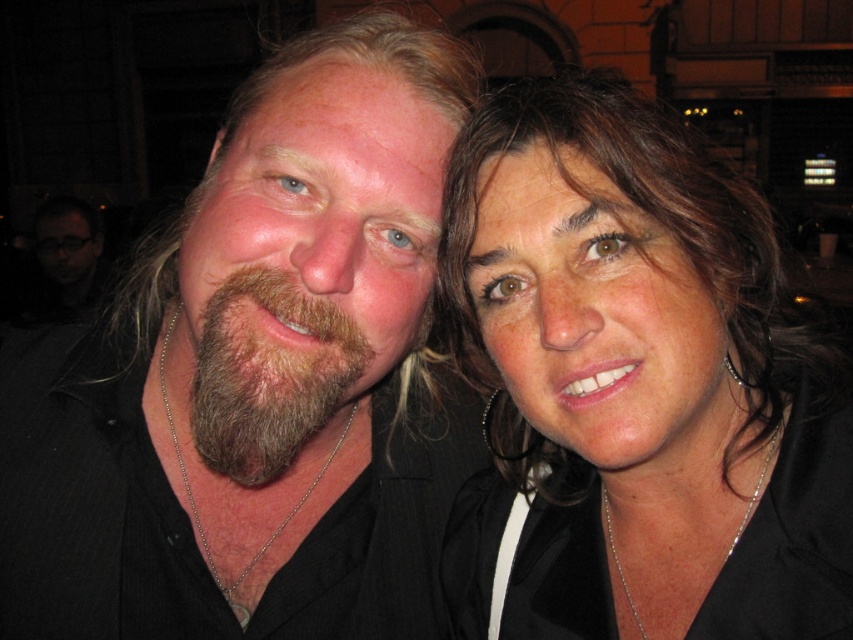
Between matte black hair at upper right and brown fuzzy beard at left, which one has more height?

Standing taller between the two is matte black hair at upper right.

Does matte black hair at upper right have a greater height compared to brown fuzzy beard at left?

Yes.

Between point (459, 305) and point (345, 385), which one is positioned behind?

Point (459, 305)

Locate an element on the screen. The image size is (853, 640). matte black hair at upper right is located at coordinates (637, 385).